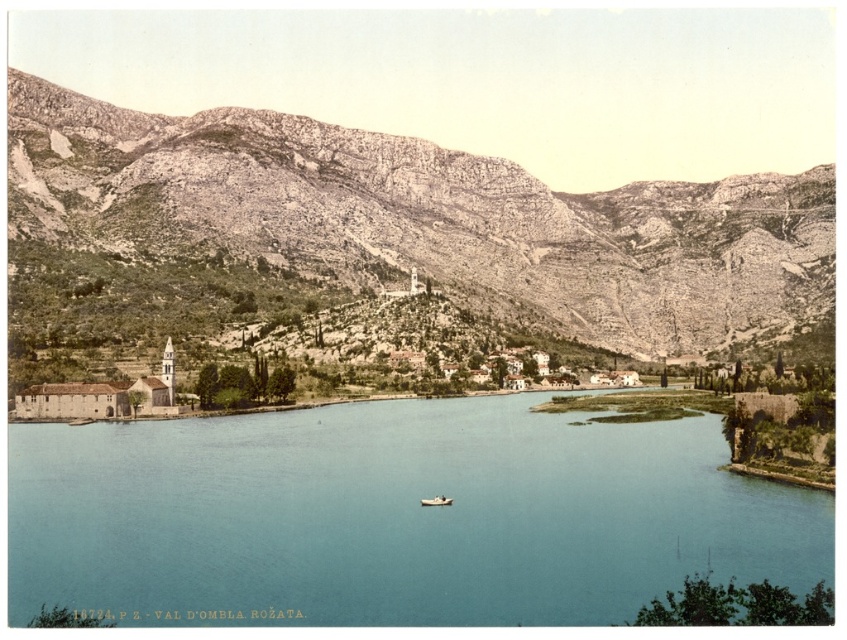
Between point (634, 468) and point (446, 502), which one is positioned in front?

Point (446, 502) is in front.

Where is `blue water at center`? This screenshot has width=847, height=640. blue water at center is located at coordinates (392, 516).

Consider the image. Who is taller, blue water at center or rugged stone mountain at center?

rugged stone mountain at center is taller.

Does point (662, 445) come in front of point (735, 221)?

Yes, it is.

Which is in front, point (318, 426) or point (511, 250)?

Point (318, 426) is more forward.

Locate an element on the screen. This screenshot has width=847, height=640. blue water at center is located at coordinates (392, 516).

Where is `rugged stone mountain at center`? This screenshot has width=847, height=640. rugged stone mountain at center is located at coordinates (430, 218).

Which is more to the left, rugged stone mountain at center or wooden boat at center?

wooden boat at center

Is point (65, 173) closer to viewer compared to point (452, 499)?

No, (65, 173) is behind (452, 499).

Find the location of a particular element. Image resolution: width=847 pixels, height=640 pixels. rugged stone mountain at center is located at coordinates (430, 218).